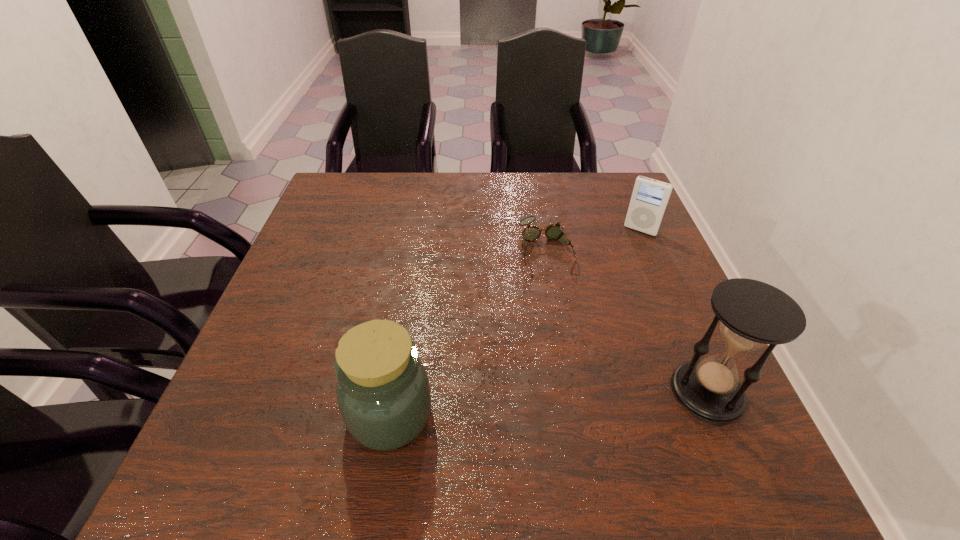
You are a GUI agent. You are given a task and a screenshot of the screen. Output one action in this format:
    pyautogui.click(x=<x>, y=<y>)
    Task: Click on the vacant region located 0.130m on the front-facing side of the spectacles
    The image size is (960, 540).
    Given the screenshot: What is the action you would take?
    pyautogui.click(x=564, y=316)

Identify the location of vacant space situated 0.180m on the front-facing side of the iPod. (611, 275).

Locate an element on the screen. Image resolution: width=960 pixels, height=540 pixels. free point located on the front-facing side of the iPod is located at coordinates (611, 275).

What are the coordinates of `vacant area situated 0.330m on the front-facing side of the iPod` in the screenshot? It's located at (587, 314).

Find the location of a particular element. The image size is (960, 540). jar located at the near edge is located at coordinates (383, 393).

This screenshot has height=540, width=960. Identify the location of hourglass situated at the near edge. (752, 313).

The height and width of the screenshot is (540, 960). I want to click on hourglass present at the right edge, so click(x=752, y=313).

I want to click on iPod that is at the right edge, so click(x=650, y=197).

At what (x,y) coordinates should I click in order to perform the action: click on object that is at the near right corner. Please return your answer as a coordinate pair (x, y). This screenshot has width=960, height=540. Looking at the image, I should click on (752, 313).

Image resolution: width=960 pixels, height=540 pixels. What are the coordinates of `vacant space at the far edge` in the screenshot? It's located at (419, 186).